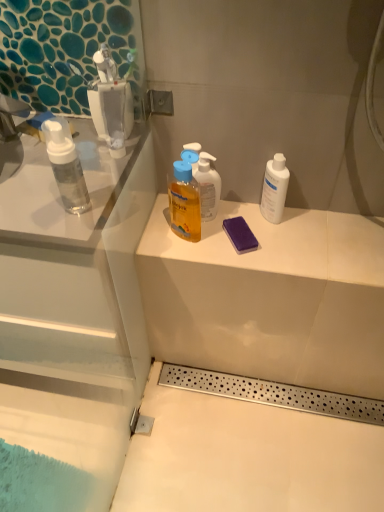
What are the coordinates of `free space behind purple sponge at center` in the screenshot? It's located at (234, 214).